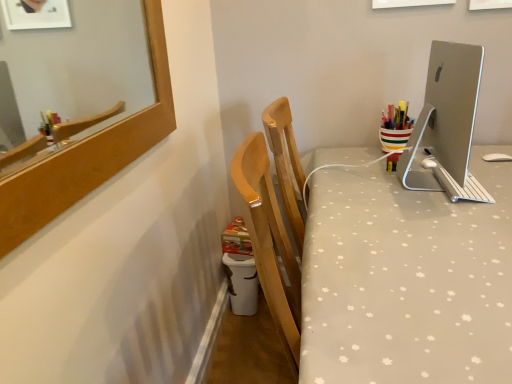
This screenshot has height=384, width=512. In order to click on free point to the left of silver metallic monitor at upper right in this screenshot , I will do `click(356, 190)`.